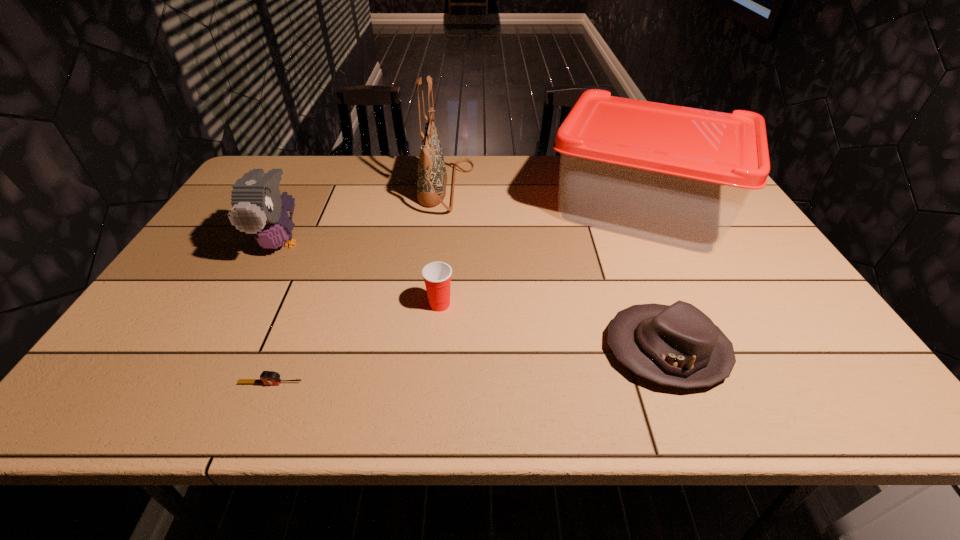
What are the coordinates of `the tallest object` in the screenshot? It's located at (432, 177).

Image resolution: width=960 pixels, height=540 pixels. In order to click on tray in this screenshot , I will do `click(676, 175)`.

The width and height of the screenshot is (960, 540). Find the location of `the leftmost object`. the leftmost object is located at coordinates (258, 208).

Where is `the fourth shortest object`? the fourth shortest object is located at coordinates (258, 208).

At what (x,y) coordinates should I click in order to perform the action: click on Dixie cup. Please return your answer as a coordinate pair (x, y). Image resolution: width=960 pixels, height=540 pixels. Looking at the image, I should click on (437, 275).

Where is `hat`? The image size is (960, 540). hat is located at coordinates 677,345.

Locate an element on the screen. Image resolution: width=960 pixels, height=540 pixels. the second object from left to right is located at coordinates (267, 377).

Find the location of a particular element. The height and width of the screenshot is (540, 960). tape measure is located at coordinates (267, 377).

Locate an element on the screen. blank area located 0.260m on the front-facing side of the handbag is located at coordinates (553, 188).

The image size is (960, 540). Identify the location of vacant area situated on the left of the tray. (439, 208).